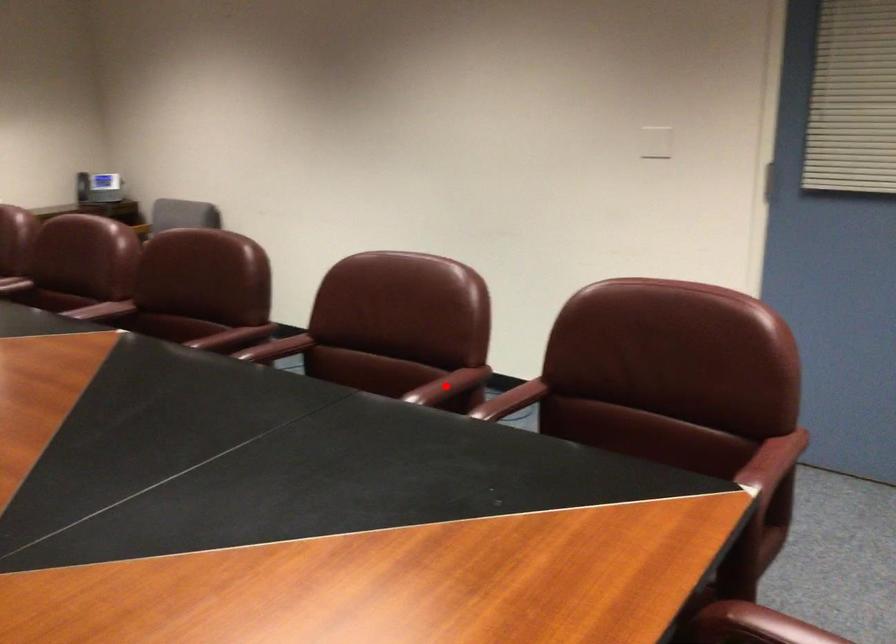
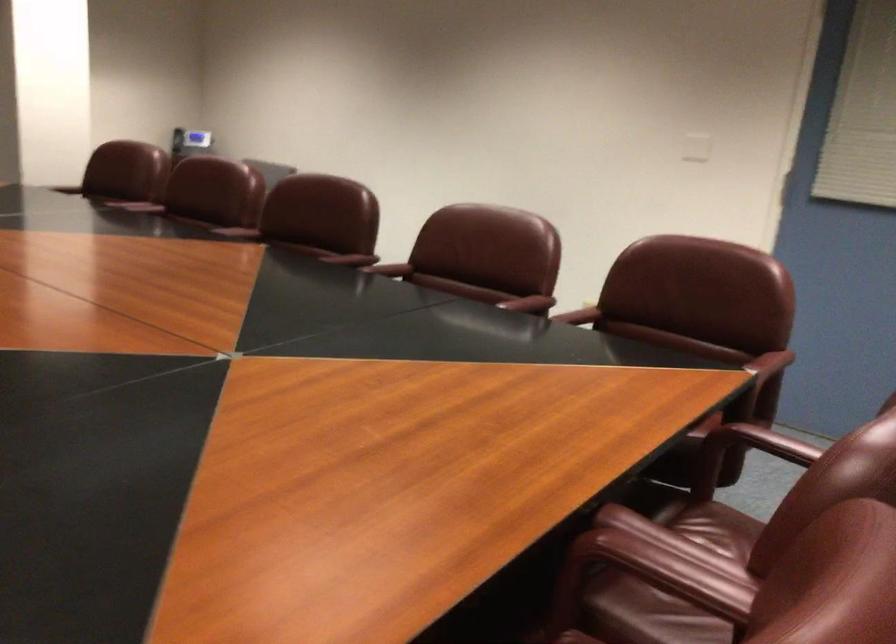
In the second image, find the point that corresponds to the highlighted location in the first image.

(529, 303)